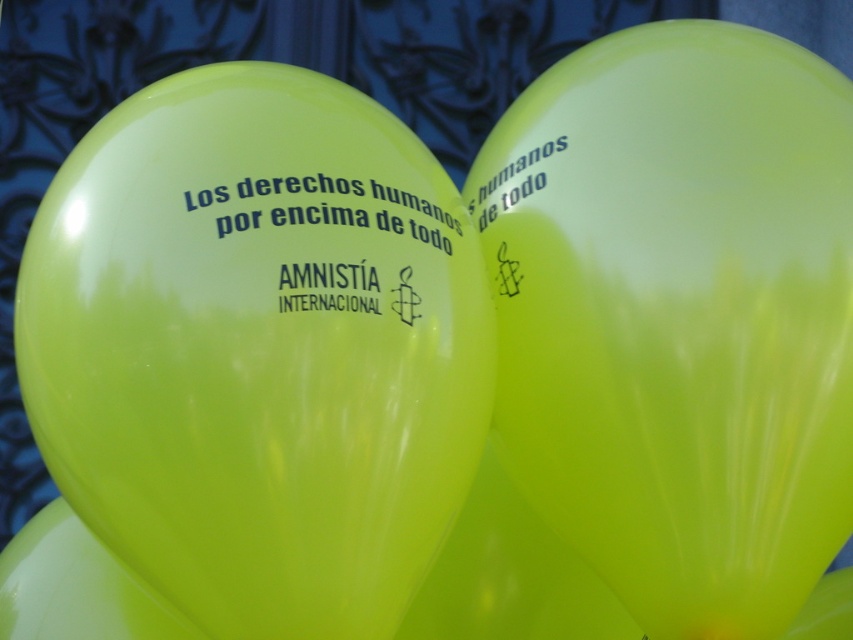
Who is lower down, lime green latex balloon at center or green glossy balloon at center?

lime green latex balloon at center

Does lime green latex balloon at center appear under green glossy balloon at center?

Correct, lime green latex balloon at center is located below green glossy balloon at center.

Which is in front, point (352, 312) or point (254, 192)?

Point (352, 312) is in front.

Identify the location of lime green latex balloon at center. Image resolution: width=853 pixels, height=640 pixels. (258, 349).

Which is more to the right, green glossy balloon at center or green glossy balloon at upper right?

green glossy balloon at upper right is more to the right.

Which is behind, point (413, 228) or point (566, 134)?

The point (566, 134) is more distant.

Does point (418, 225) come closer to viewer compared to point (529, 163)?

Yes.

Locate an element on the screen. This screenshot has width=853, height=640. green glossy balloon at center is located at coordinates tap(339, 209).

Is lime green latex balloon at center to the right of green glossy balloon at upper right from the viewer's perspective?

Incorrect, lime green latex balloon at center is not on the right side of green glossy balloon at upper right.

Is point (332, 492) more distant than point (523, 182)?

No.

The width and height of the screenshot is (853, 640). I want to click on lime green latex balloon at center, so click(x=258, y=349).